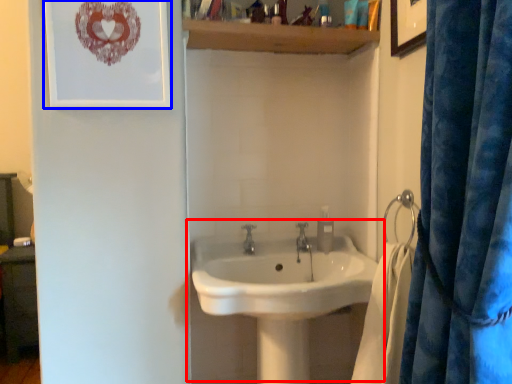
Question: Among these objects, which one is farthest to the camera, sink (highlighted by a red box) or picture frame (highlighted by a blue box)?

Choices:
 (A) sink
 (B) picture frame

Answer: (B)